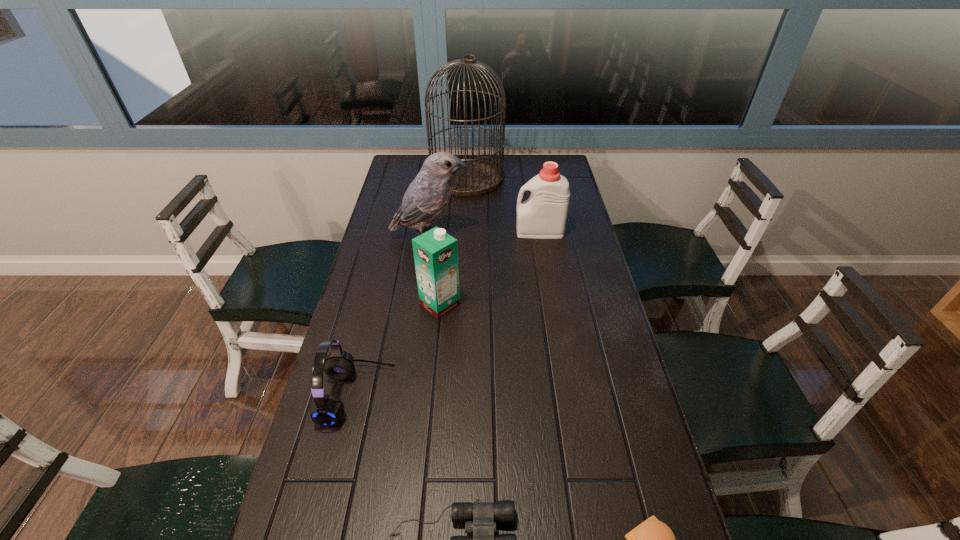
Locate an element on the screen. The width and height of the screenshot is (960, 540). the tallest object is located at coordinates (483, 175).

Identify the location of birdcage. The width and height of the screenshot is (960, 540). (483, 175).

Locate an element on the screen. the sixth shortest object is located at coordinates (427, 196).

The width and height of the screenshot is (960, 540). I want to click on detergent, so click(x=543, y=215).

The height and width of the screenshot is (540, 960). Find the location of `carton`. carton is located at coordinates (435, 252).

Where is `headset`? headset is located at coordinates (326, 410).

You are a GUI agent. You are given a task and a screenshot of the screen. Output one action in this format:
    pyautogui.click(x=<x>, y=<y>)
    Task: Click on the fifth farthest object
    
    Given the screenshot: What is the action you would take?
    pyautogui.click(x=326, y=410)

The image size is (960, 540). Identify the location of vacant space located on the right of the farthest object. (562, 177).

This screenshot has width=960, height=540. I want to click on vacant space located 0.130m on the front-facing side of the sixth shortest object, so click(x=507, y=237).

At what (x,y) coordinates should I click in order to perform the action: click on blank area located on the handle side of the detergent. Please return your answer as a coordinate pair (x, y). Looking at the image, I should click on (401, 232).